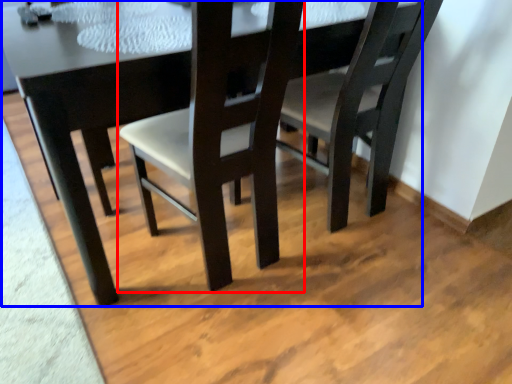
Question: Which of the following is the farthest to the observer, chair (highlighted by a red box) or table (highlighted by a blue box)?

Choices:
 (A) chair
 (B) table

Answer: (B)